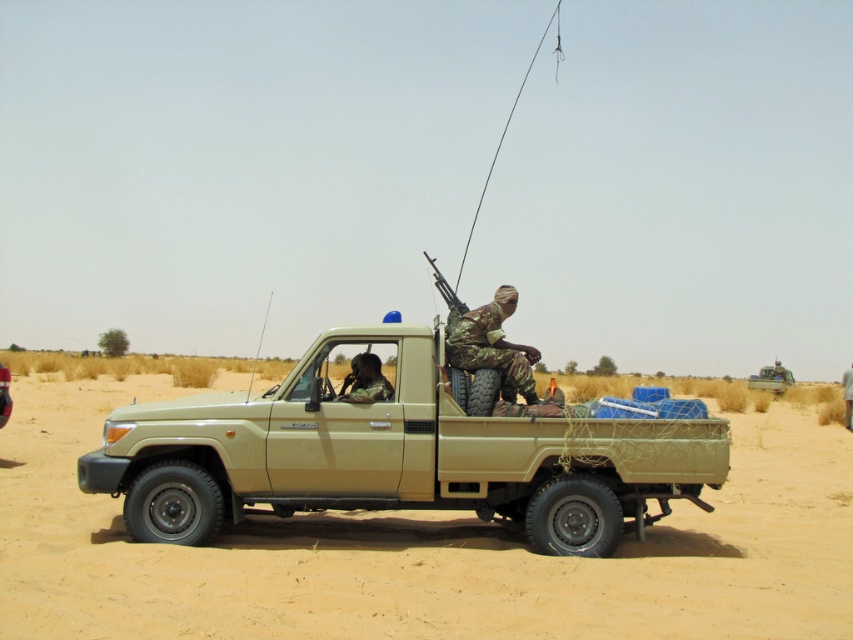
Consider the image. You are a drone operator trying to capture coordinates on a desert scene. You have two points marked as point 1 at (265, 477) and point 2 at (363, 362). Which point is closer to the camera?

Point 1 at (265, 477) is closer to the camera than point 2 at (363, 362).

Based on the scene description, if you were to place a small flag on the sandy beige dirt field at center and another small flag on the camouflage fabric helmet at center, which flag would be higher up from the ground?

The sandy beige dirt field at center is much taller than the camouflage fabric helmet at center, so the flag placed on the sandy beige dirt field at center would be higher up from the ground.